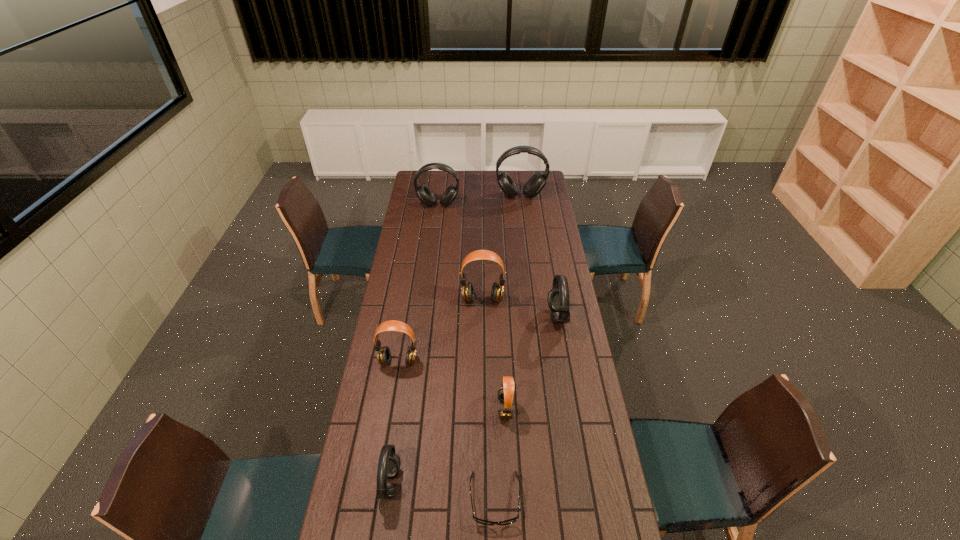
You are a GUI agent. You are given a task and a screenshot of the screen. Output one action in this format:
    pyautogui.click(x=<x>, y=<y>)
    Task: Click on the free spot between the biggest gray headset and the third nearest object
    This screenshot has width=960, height=540.
    Given the screenshot: What is the action you would take?
    pyautogui.click(x=513, y=302)

The image size is (960, 540). I want to click on empty space that is in between the farthest brown headset and the biggest gray headset, so click(x=501, y=247).

At what (x,y) coordinates should I click in order to perform the action: click on blank region between the tallest object and the farthest brown headset. Please return your answer as a coordinate pair (x, y). This screenshot has height=540, width=960. Looking at the image, I should click on (501, 247).

Where is `vacant region between the third farthest gray headset and the biggest brown headset`? vacant region between the third farthest gray headset and the biggest brown headset is located at coordinates (520, 308).

This screenshot has width=960, height=540. Find the location of `free space that is in between the shortest object and the fifth farthest object`. free space that is in between the shortest object and the fifth farthest object is located at coordinates (446, 430).

At what (x,y) coordinates should I click in order to perform the action: click on vacant space that's between the spectacles and the nearest headset. Please return your answer as a coordinate pair (x, y). This screenshot has height=540, width=960. Looking at the image, I should click on (443, 491).

The width and height of the screenshot is (960, 540). Identify the location of blank region between the third smallest gray headset and the tallest object. (479, 200).

You are a GUI agent. You are given a task and a screenshot of the screen. Output one action in this format:
    pyautogui.click(x=<x>, y=<y>)
    Task: Click on the free space between the second smallest gray headset and the spectacles
    
    Given the screenshot: What is the action you would take?
    pyautogui.click(x=526, y=408)

At what (x,y) coordinates should I click in order to perform the action: click on the fifth closest object to the nearest headset. Please return your answer as a coordinate pair (x, y). The image size is (960, 540). Looking at the image, I should click on (558, 297).

This screenshot has height=540, width=960. I want to click on object that is the sixth nearest to the third farthest gray headset, so click(537, 181).